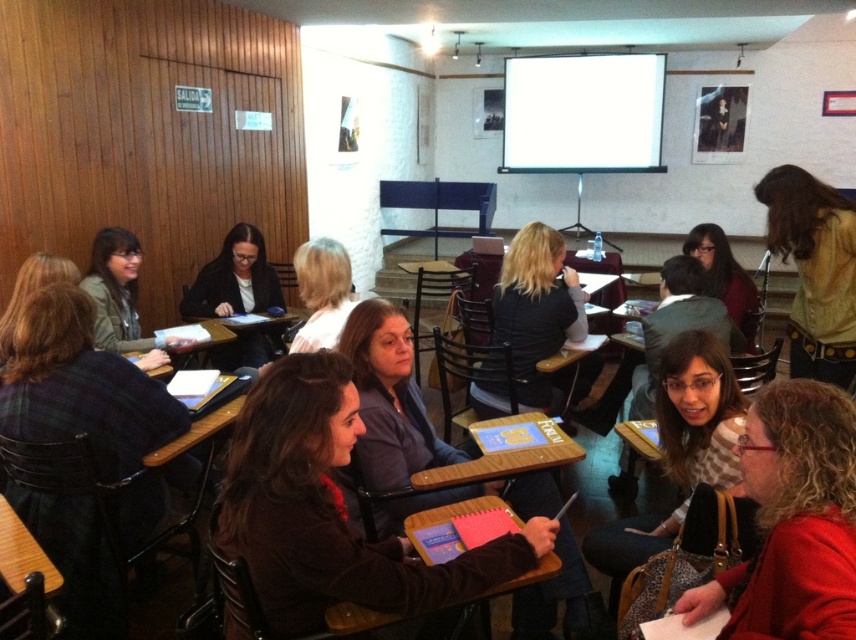
Question: Does matte brown hair at lower right lie behind blonde hair at center?

Choices:
 (A) yes
 (B) no

Answer: (B)

Question: Which object is the farthest from the dark brown sweater at center?

Choices:
 (A) yellow textured blouse at right
 (B) matte brown hair at lower right

Answer: (A)

Question: Which object appears farthest from the camera in this image?

Choices:
 (A) matte black jacket at center
 (B) matte brown hair at center
 (C) dark brown hair at center

Answer: (A)

Question: Can you confirm if matte brown hair at lower right is thinner than matte black hair at center?

Choices:
 (A) no
 (B) yes

Answer: (B)

Question: Is matte brown hair at center to the right of matte black hair at center from the viewer's perspective?

Choices:
 (A) no
 (B) yes

Answer: (A)

Question: Estimate the real-world distances between objects in this image. Which object is closer to the dark brown hair at center?

Choices:
 (A) matte black jacket at center
 (B) matte brown hair at lower right

Answer: (A)